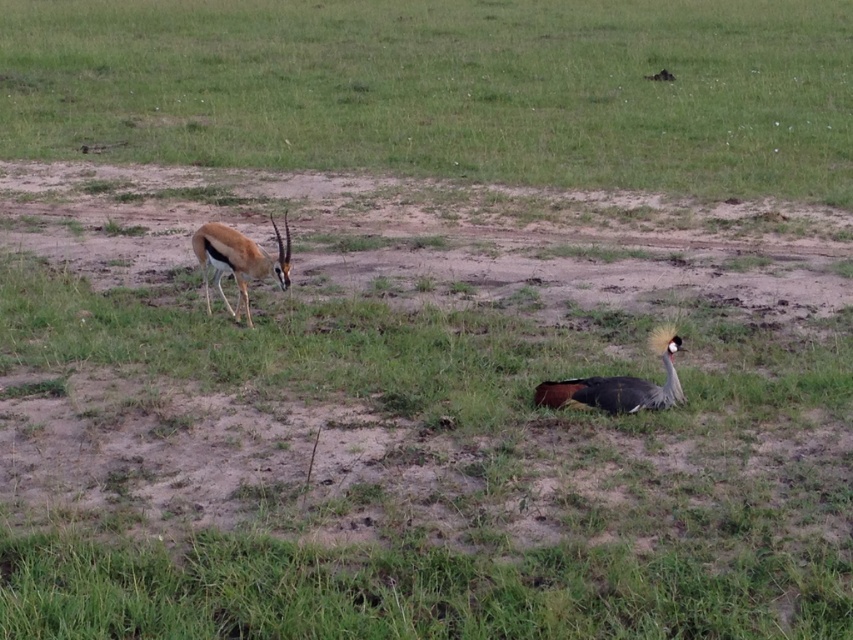
Based on the photo, who is higher up, gray feathered bird at lower right or brown glossy antelope at left?

brown glossy antelope at left

Can you confirm if gray feathered bird at lower right is positioned to the right of brown glossy antelope at left?

Correct, you'll find gray feathered bird at lower right to the right of brown glossy antelope at left.

This screenshot has width=853, height=640. What do you see at coordinates (621, 384) in the screenshot?
I see `gray feathered bird at lower right` at bounding box center [621, 384].

The height and width of the screenshot is (640, 853). In order to click on gray feathered bird at lower right in this screenshot , I will do `click(621, 384)`.

Is point (84, 131) farther from viewer compared to point (242, 248)?

Yes, it is.

Can you confirm if green grass at center is positioned to the right of brown glossy antelope at left?

Indeed, green grass at center is positioned on the right side of brown glossy antelope at left.

Is point (851, 1) positioned after point (286, 269)?

Yes, it is behind point (286, 269).

This screenshot has width=853, height=640. In order to click on green grass at center in this screenshot , I will do `click(444, 88)`.

Does green grass at center have a larger size compared to gray feathered bird at lower right?

Indeed, green grass at center has a larger size compared to gray feathered bird at lower right.

Between green grass at center and gray feathered bird at lower right, which one has less height?

With less height is gray feathered bird at lower right.

Based on the photo, who is more forward, (714, 113) or (598, 380)?

Point (598, 380)

Identify the location of green grass at center. (444, 88).